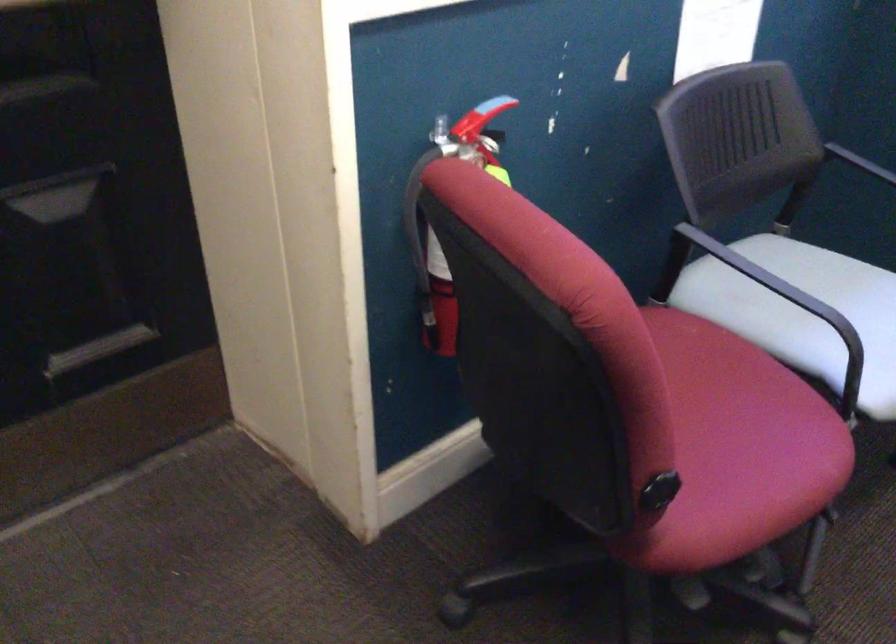
You are a GUI agent. You are given a task and a screenshot of the screen. Output one action in this format:
    pyautogui.click(x=<x>, y=<y>)
    Task: Click on the red chair sitting surface
    Image resolution: width=896 pixels, height=644 pixels.
    Given the screenshot: What is the action you would take?
    pyautogui.click(x=714, y=366)